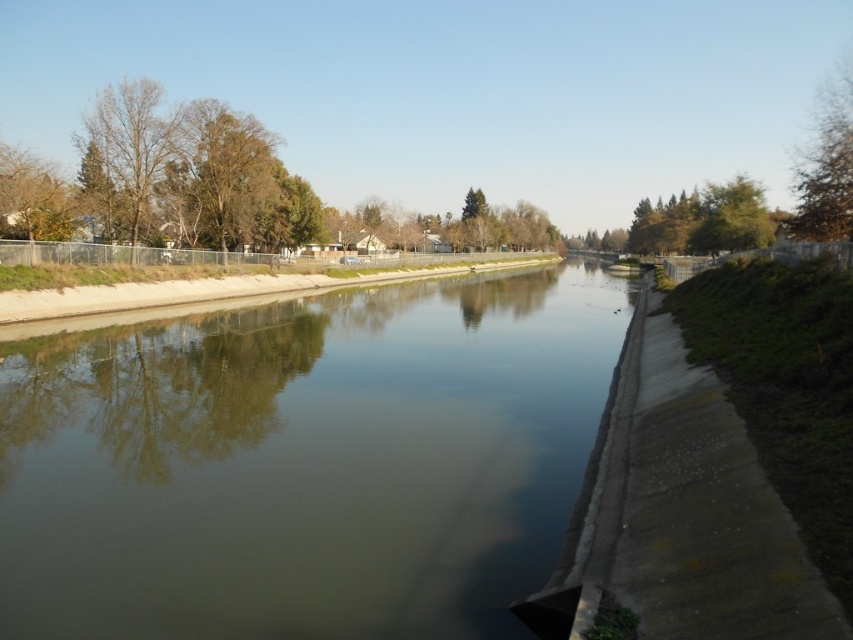
Question: Is green concrete river at center wider than bare branches at left?

Choices:
 (A) yes
 (B) no

Answer: (A)

Question: Is green concrete river at center to the left of green leafy tree at upper right from the viewer's perspective?

Choices:
 (A) yes
 (B) no

Answer: (A)

Question: Among these objects, which one is nearest to the camera?

Choices:
 (A) green concrete river at center
 (B) bare branches at left

Answer: (A)

Question: Which of the following is the farthest from the observer?

Choices:
 (A) bare branches at left
 (B) green concrete river at center

Answer: (A)

Question: Can you confirm if green concrete river at center is thinner than green leafy tree at upper right?

Choices:
 (A) yes
 (B) no

Answer: (A)

Question: Which of the following is the closest to the observer?

Choices:
 (A) bare branches at left
 (B) green leafy tree at upper right
 (C) green concrete river at center

Answer: (C)